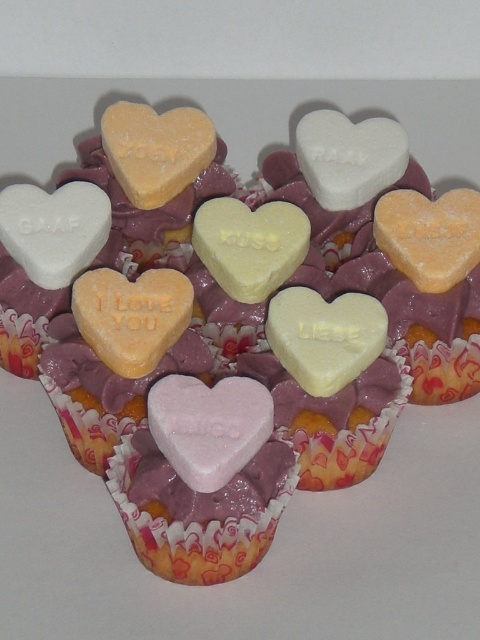
Question: Which point is farther to the camera?

Choices:
 (A) (0, 225)
 (B) (215, 428)

Answer: (A)

Question: Among these points, which one is farthest from the camera?

Choices:
 (A) (22, 253)
 (B) (373, 172)
 (C) (239, 419)

Answer: (B)

Question: Can you confirm if white matte heart at upper left is wider than white matte heart at center?

Choices:
 (A) yes
 (B) no

Answer: (B)

Question: Which point appears farthest from the camera in this image?

Choices:
 (A) (44, 288)
 (B) (400, 157)

Answer: (B)

Question: Can you confirm if white matte heart at upper left is positioned to the right of white matte heart at center?

Choices:
 (A) yes
 (B) no

Answer: (B)

Question: Is pink matte heart at center in front of white matte heart at center?

Choices:
 (A) yes
 (B) no

Answer: (A)